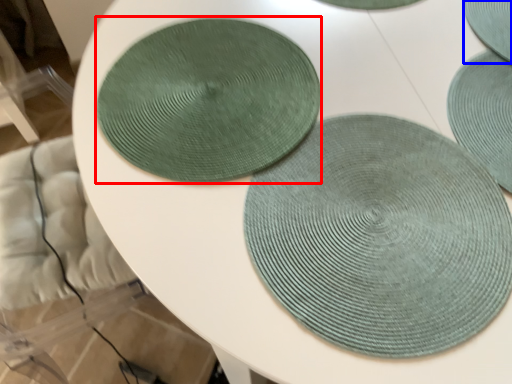
Question: Among these objects, which one is farthest to the camera, coaster (highlighted by a red box) or coaster (highlighted by a blue box)?

Choices:
 (A) coaster
 (B) coaster

Answer: (B)